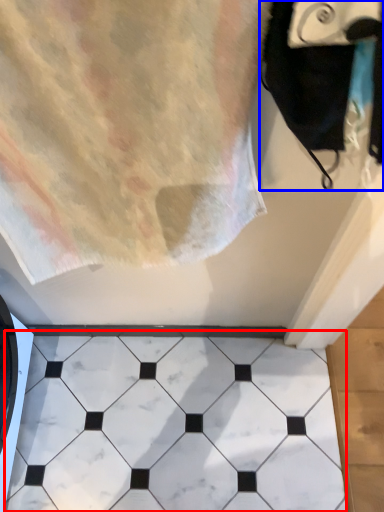
Question: Which object is closer to the camera taking this photo, marble (highlighted by a red box) or bath towel (highlighted by a blue box)?

Choices:
 (A) marble
 (B) bath towel

Answer: (B)